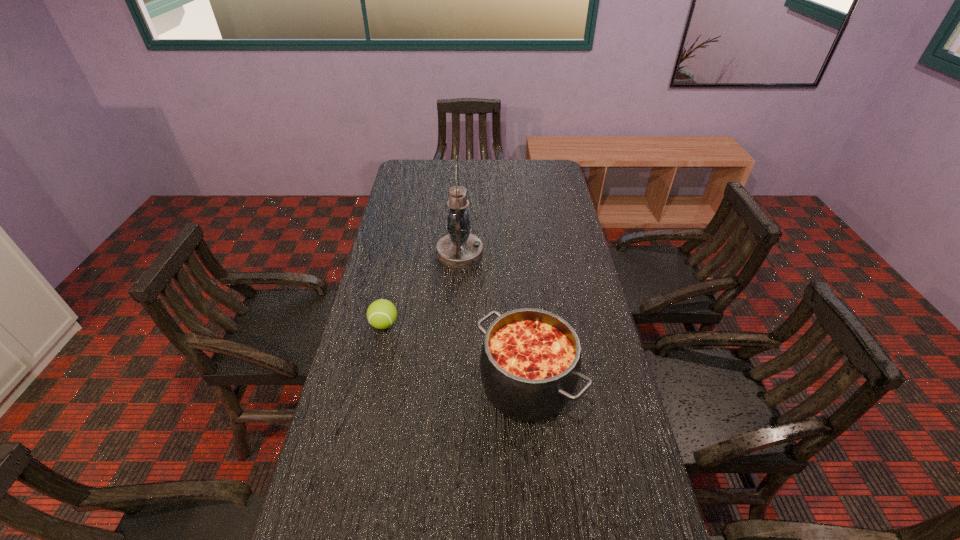
Locate an element on the screen. the farthest object is located at coordinates (459, 248).

Locate an element on the screen. oil lamp is located at coordinates (459, 248).

Locate an element on the screen. The height and width of the screenshot is (540, 960). casserole is located at coordinates (530, 361).

What are the coordinates of `the second tallest object` in the screenshot? It's located at (530, 361).

Locate an element on the screen. The height and width of the screenshot is (540, 960). the leftmost object is located at coordinates (381, 314).

Find the location of a particular element. This screenshot has height=540, width=960. tennis ball is located at coordinates (381, 314).

Locate an element on the screen. This screenshot has width=960, height=540. vacant space located 0.350m on the right of the farthest object is located at coordinates (579, 253).

I want to click on vacant space located 0.170m on the left of the second tallest object, so click(x=414, y=384).

Find the location of a particular element. vacant space positioned on the back of the leftmost object is located at coordinates (397, 261).

You are a GUI agent. You are given a task and a screenshot of the screen. Output one action in this format:
    pyautogui.click(x=<x>, y=<y>)
    Task: Click on the object that is at the left edge
    
    Given the screenshot: What is the action you would take?
    pyautogui.click(x=381, y=314)